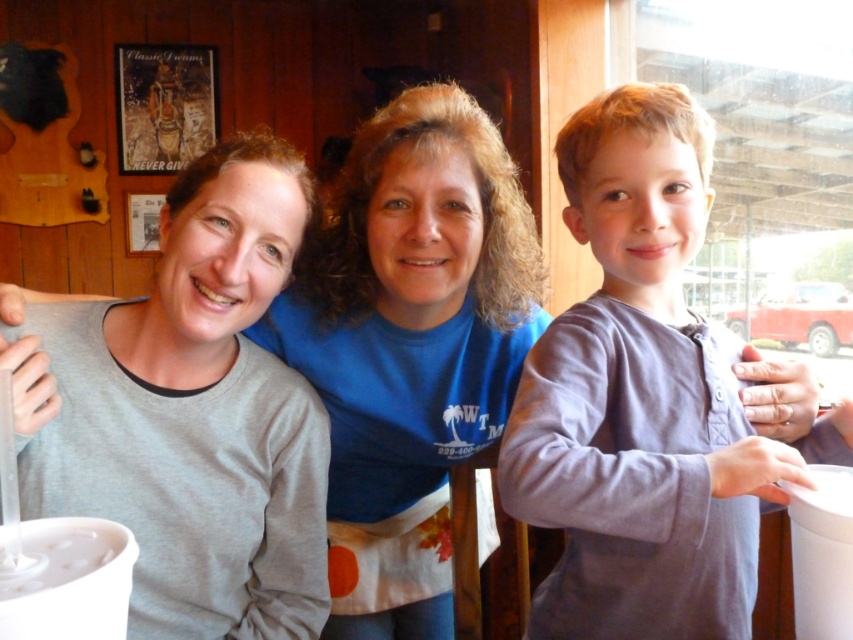
Question: Can you confirm if gray cotton shirt at center is bigger than blue cotton shirt at center?

Choices:
 (A) yes
 (B) no

Answer: (B)

Question: Does gray cotton shirt at center have a smaller size compared to blue cotton shirt at center?

Choices:
 (A) yes
 (B) no

Answer: (A)

Question: Which object appears closest to the camera in this image?

Choices:
 (A) gray cotton shirt at center
 (B) blue cotton shirt at center

Answer: (A)

Question: Can you confirm if gray cotton shirt at center is positioned to the right of blue cotton shirt at center?

Choices:
 (A) yes
 (B) no

Answer: (A)

Question: Which point is closer to the camera?

Choices:
 (A) gray cotton shirt at center
 (B) blue cotton shirt at center

Answer: (A)